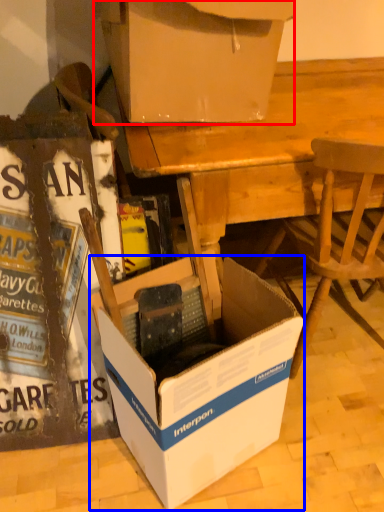
Question: Which of the following is the closest to the observer, box (highlighted by a red box) or box (highlighted by a blue box)?

Choices:
 (A) box
 (B) box

Answer: (B)